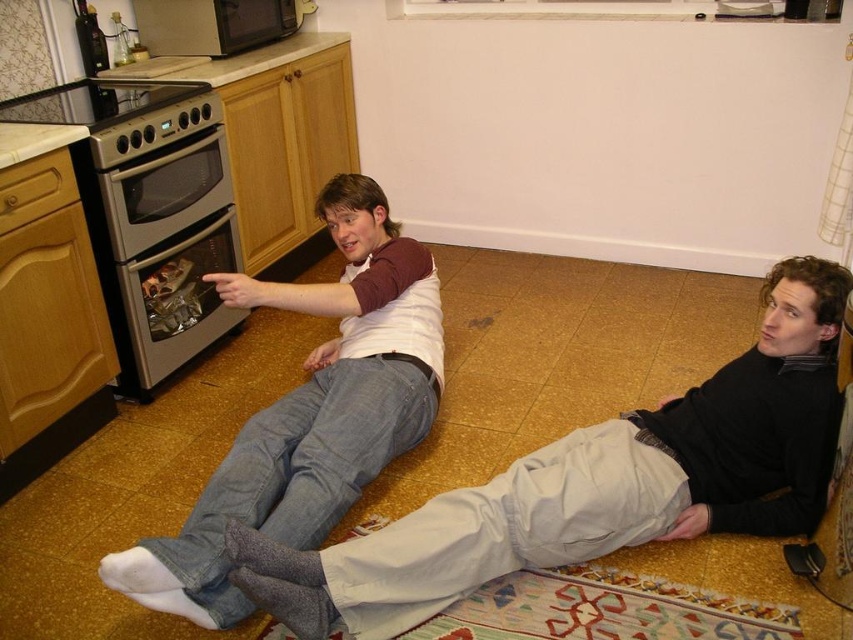
You are standing in the kitchen scene and want to place a small plant between the two points, point (227, 570) and point (244, 44). Which point should the plant be closer to in order to be nearer to the viewer?

→ The plant should be closer to point (227, 570) because it is nearer to the viewer than point (244, 44).

Consider the image. You are standing in the kitchen and see the point marked at coordinates (309, 412). What object is located at that point?

The point at coordinates (309, 412) marks denim jeans at left.